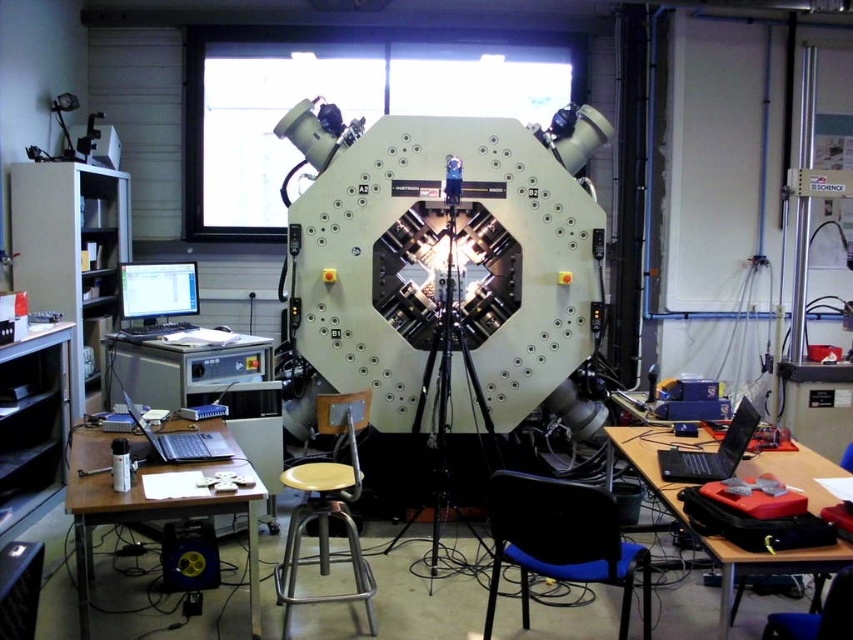
Consider the image. Does brown wooden table at lower left have a smaller size compared to black glossy laptop at right?

Incorrect, brown wooden table at lower left is not smaller in size than black glossy laptop at right.

How distant is brown wooden table at lower left from black glossy laptop at right?

A distance of 5.59 feet exists between brown wooden table at lower left and black glossy laptop at right.

Which is in front, point (74, 524) or point (756, 422)?

Point (74, 524) is in front.

This screenshot has height=640, width=853. Identify the location of brown wooden table at lower left. (149, 502).

How distant is metallic tripod at center from black glossy laptop at right?

4.23 feet

Who is lower down, metallic tripod at center or black glossy laptop at right?

black glossy laptop at right is lower down.

Who is more distant from viewer, (439, 449) or (689, 461)?

Point (439, 449)

Identify the location of metallic tripod at center. (450, 385).

Does matte black laptop at left appear on the left side of blue plastic chair at lower right?

Correct, you'll find matte black laptop at left to the left of blue plastic chair at lower right.

Is point (140, 269) less distant than point (844, 582)?

No, it is not.

Locate an element on the screen. This screenshot has width=853, height=640. matte black laptop at left is located at coordinates (158, 289).